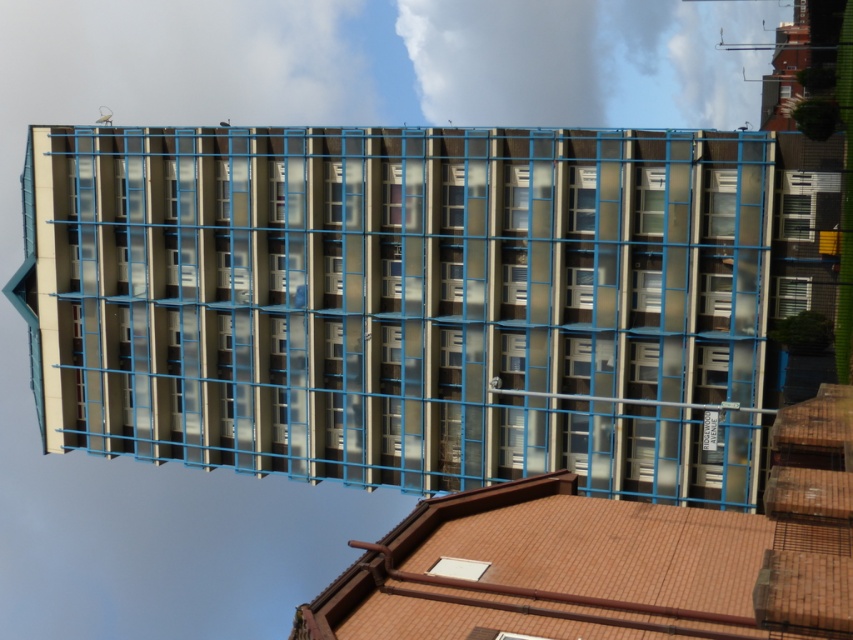
Does clear glass window at right have a smaller size compared to white textured window at right?

Yes.

Who is shorter, clear glass window at right or white textured window at right?

With less height is white textured window at right.

You are a GUI agent. You are given a task and a screenshot of the screen. Output one action in this format:
    pyautogui.click(x=<x>, y=<y>)
    Task: Click on the clear glass window at right
    
    Given the screenshot: What is the action you would take?
    pyautogui.click(x=796, y=216)

Where is `clear glass window at right`? This screenshot has height=640, width=853. clear glass window at right is located at coordinates (796, 216).